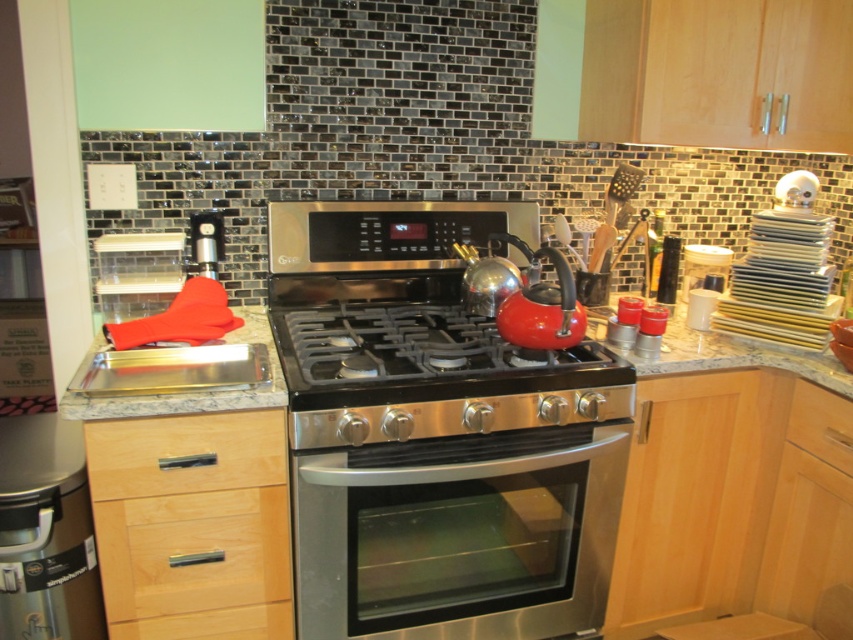
What do you see at coordinates (735, 356) in the screenshot?
I see `granite countertop at center` at bounding box center [735, 356].

Is granite countertop at center to the left of wooden drawer at lower right from the viewer's perspective?

Indeed, granite countertop at center is positioned on the left side of wooden drawer at lower right.

Is point (122, 401) closer to viewer compared to point (827, 392)?

Yes, point (122, 401) is closer to viewer.

You are a GUI agent. You are given a task and a screenshot of the screen. Output one action in this format:
    pyautogui.click(x=<x>, y=<y>)
    Task: Click on the granite countertop at center
    Image resolution: width=853 pixels, height=640 pixels.
    Given the screenshot: What is the action you would take?
    pyautogui.click(x=735, y=356)

What do you see at coordinates (184, 452) in the screenshot?
I see `light wood/dark finish drawer at lower left` at bounding box center [184, 452].

Where is `light wood/dark finish drawer at lower left`? light wood/dark finish drawer at lower left is located at coordinates click(x=184, y=452).

Does point (163, 445) come farther from viewer compared to point (281, 380)?

That is False.

Find the location of a particular element. The width and height of the screenshot is (853, 640). light wood/dark finish drawer at lower left is located at coordinates (184, 452).

What do you see at coordinates (192, 552) in the screenshot? I see `light wood/wooden drawer at lower left` at bounding box center [192, 552].

Between light wood/wooden drawer at lower left and wooden drawer at lower right, which one has less height?

wooden drawer at lower right

The height and width of the screenshot is (640, 853). Identify the location of light wood/wooden drawer at lower left. (192, 552).

Locate an element on the screen. This screenshot has width=853, height=640. light wood/wooden drawer at lower left is located at coordinates (192, 552).